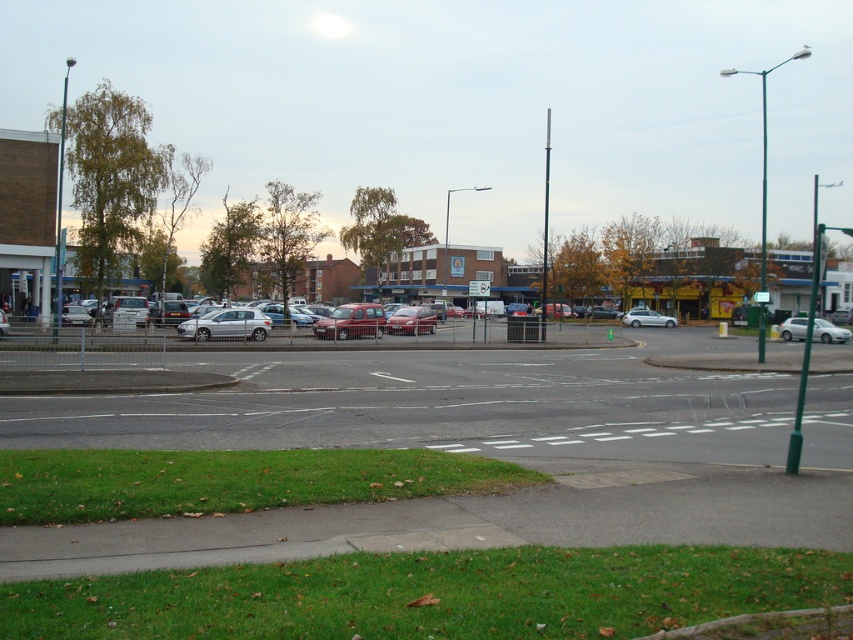
You are standing at the center of the image where the sidewalk curves. You want to walk to the white matte car at right. Which direction should you go?

Since the white matte car at right is located at point (828,332) in the image, you should walk towards the right side of the image to reach it.

You are a pedestrian standing on the sidewalk and want to cross the road to reach the parking lot. You see the white matte car at right and the metallic silver car at center. Which car is closer to the road edge?

The white matte car at right is closer to the road edge because it is positioned below the metallic silver car at center, meaning it is lower in the image and thus closer to the road edge.